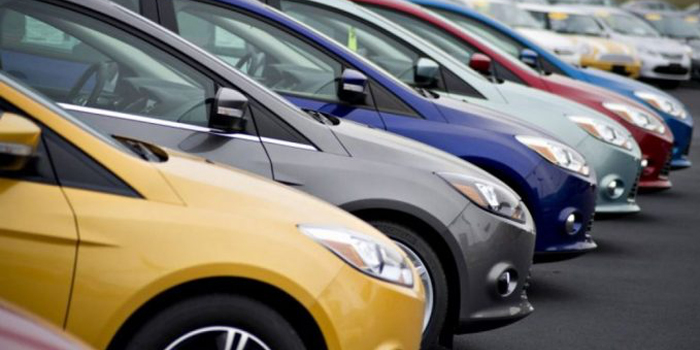
Where is `door`? Image resolution: width=700 pixels, height=350 pixels. door is located at coordinates tap(48, 255), tap(216, 154), tap(344, 114), tap(421, 89).